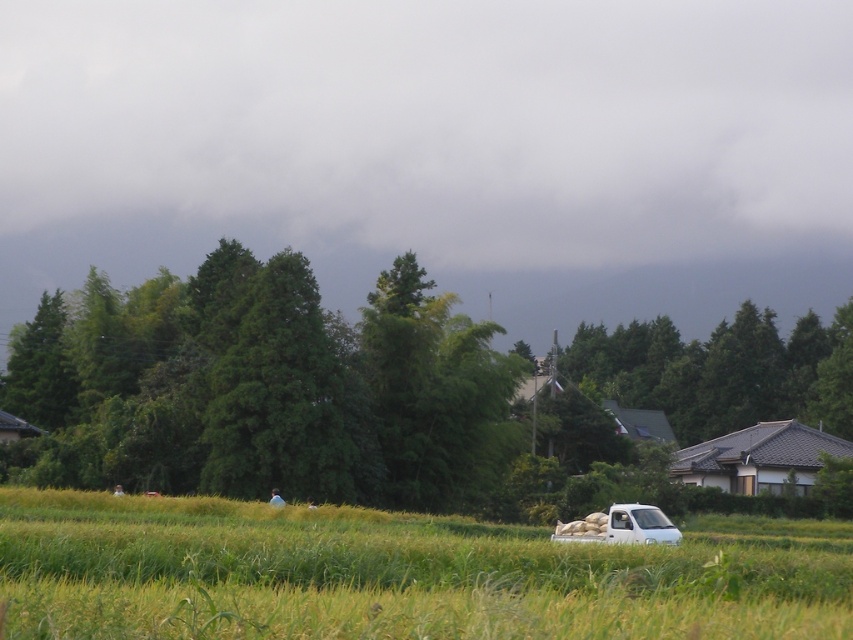
From the picture: Who is taller, yellow-green grass at lower center or green leafy tree at center?

green leafy tree at center

Locate an element on the screen. The height and width of the screenshot is (640, 853). yellow-green grass at lower center is located at coordinates (398, 573).

The image size is (853, 640). Describe the element at coordinates (398, 573) in the screenshot. I see `yellow-green grass at lower center` at that location.

This screenshot has height=640, width=853. What are the coordinates of `yellow-green grass at lower center` in the screenshot? It's located at (398, 573).

Is yellow-green grass at lower center bigger than brown tiled roof at right?

Correct, yellow-green grass at lower center is larger in size than brown tiled roof at right.

Does yellow-green grass at lower center have a greater width compared to brown tiled roof at right?

Yes, yellow-green grass at lower center is wider than brown tiled roof at right.

Where is `yellow-green grass at lower center`? Image resolution: width=853 pixels, height=640 pixels. yellow-green grass at lower center is located at coordinates (398, 573).

Is green leafy tree at center below brown tiled roof at right?

Actually, green leafy tree at center is above brown tiled roof at right.

Which is more to the right, green leafy tree at center or brown tiled roof at right?

From the viewer's perspective, green leafy tree at center appears more on the right side.

Between point (840, 387) and point (670, 468), which one is positioned in front?

Positioned in front is point (670, 468).

Find the location of a particular element. This screenshot has width=853, height=640. green leafy tree at center is located at coordinates (721, 371).